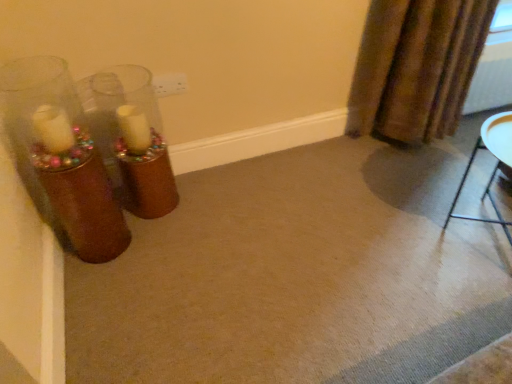
This screenshot has width=512, height=384. Find the location of `metallic silver tray at lower right`. metallic silver tray at lower right is located at coordinates (494, 167).

What do you see at coordinates (494, 167) in the screenshot?
I see `metallic silver tray at lower right` at bounding box center [494, 167].

Measure the distance between brown textured curtain at upper right and camera.

The depth of brown textured curtain at upper right is 5.59 feet.

The height and width of the screenshot is (384, 512). Identify the location of brown textured curtain at upper right. (417, 67).

In order to face brown textured curtain at upper right, should I rotate leftwards or rightwards?

You should look right and rotate roughly 23.054 degrees.

This screenshot has height=384, width=512. What do you see at coordinates (417, 67) in the screenshot?
I see `brown textured curtain at upper right` at bounding box center [417, 67].

Locate an element on the screen. This screenshot has height=384, width=512. metallic silver tray at lower right is located at coordinates (494, 167).

Does brown textured curtain at upper right appear on the left side of metallic silver tray at lower right?

Yes, brown textured curtain at upper right is to the left of metallic silver tray at lower right.

Who is more distant, brown textured curtain at upper right or metallic silver tray at lower right?

brown textured curtain at upper right.

Considering the points (430, 26) and (498, 166), which point is in front, point (430, 26) or point (498, 166)?

The point (430, 26) is more forward.

Based on the photo, from the image's perspective, which is above, brown textured curtain at upper right or metallic silver tray at lower right?

From the image's view, brown textured curtain at upper right is above.

From a real-world perspective, is brown textured curtain at upper right physically below metallic silver tray at lower right?

No.

In the scene shown: In terms of width, does brown textured curtain at upper right look wider or thinner when compared to metallic silver tray at lower right?

Clearly, brown textured curtain at upper right has less width compared to metallic silver tray at lower right.

Considering the sizes of brown textured curtain at upper right and metallic silver tray at lower right in the image, is brown textured curtain at upper right taller or shorter than metallic silver tray at lower right?

Considering their sizes, brown textured curtain at upper right has more height than metallic silver tray at lower right.

Who is bigger, brown textured curtain at upper right or metallic silver tray at lower right?

With larger size is brown textured curtain at upper right.

Based on the photo, could metallic silver tray at lower right be considered to be inside brown textured curtain at upper right?

That's incorrect, metallic silver tray at lower right is not inside brown textured curtain at upper right.

Looking at this image, is brown textured curtain at upper right far from metallic silver tray at lower right?

That's not correct — brown textured curtain at upper right is a little close to metallic silver tray at lower right.

Could you tell me if brown textured curtain at upper right is turned towards metallic silver tray at lower right?

Yes, brown textured curtain at upper right is oriented towards metallic silver tray at lower right.

What's the angular difference between brown textured curtain at upper right and metallic silver tray at lower right's facing directions?

brown textured curtain at upper right and metallic silver tray at lower right are facing 86.4 degrees away from each other.

Locate an element on the screen. furniture to the right of brown textured curtain at upper right is located at coordinates (494, 167).

Considering the relative positions of metallic silver tray at lower right and brown textured curtain at upper right in the image provided, is metallic silver tray at lower right to the left of brown textured curtain at upper right from the viewer's perspective?

Incorrect, metallic silver tray at lower right is not on the left side of brown textured curtain at upper right.

Which is in front, metallic silver tray at lower right or brown textured curtain at upper right?

metallic silver tray at lower right is more forward.

Does point (490, 201) lie behind point (428, 26)?

Yes, point (490, 201) is farther from viewer.

From the image's perspective, which one is positioned higher, metallic silver tray at lower right or brown textured curtain at upper right?

brown textured curtain at upper right, from the image's perspective.

From a real-world perspective, is metallic silver tray at lower right physically located above or below brown textured curtain at upper right?

metallic silver tray at lower right is below brown textured curtain at upper right.

Is metallic silver tray at lower right thinner than brown textured curtain at upper right?

Incorrect, the width of metallic silver tray at lower right is not less than that of brown textured curtain at upper right.

Between metallic silver tray at lower right and brown textured curtain at upper right, which one has more height?

brown textured curtain at upper right.

In the scene shown: Looking at the image, does metallic silver tray at lower right seem bigger or smaller compared to brown textured curtain at upper right?

In the image, metallic silver tray at lower right appears to be smaller than brown textured curtain at upper right.

Could brown textured curtain at upper right be considered to be inside metallic silver tray at lower right?

No, brown textured curtain at upper right is not a part of metallic silver tray at lower right.

Is metallic silver tray at lower right touching brown textured curtain at upper right?

No, metallic silver tray at lower right is not beside brown textured curtain at upper right.

Is metallic silver tray at lower right looking in the opposite direction of brown textured curtain at upper right?

No, brown textured curtain at upper right is not at the back of metallic silver tray at lower right.

Measure the distance between metallic silver tray at lower right and brown textured curtain at upper right.

metallic silver tray at lower right is 20.65 inches away from brown textured curtain at upper right.

Locate an element on the screen. furniture that is below the brown textured curtain at upper right (from the image's perspective) is located at coordinates (494, 167).

Locate an element on the screen. Image resolution: width=512 pixels, height=384 pixels. curtain that appears above the metallic silver tray at lower right (from a real-world perspective) is located at coordinates (417, 67).

You are a GUI agent. You are given a task and a screenshot of the screen. Output one action in this format:
    pyautogui.click(x=<x>, y=<y>)
    Task: Click on the curtain on the left side of metallic silver tray at lower right
    This screenshot has width=512, height=384.
    Given the screenshot: What is the action you would take?
    pyautogui.click(x=417, y=67)